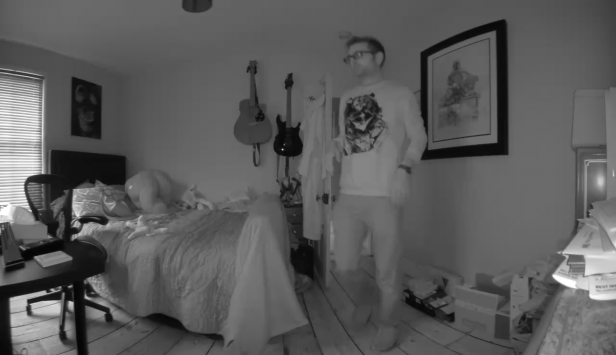
Find the location of a particular element. The width and height of the screenshot is (616, 355). bed is located at coordinates (177, 248).